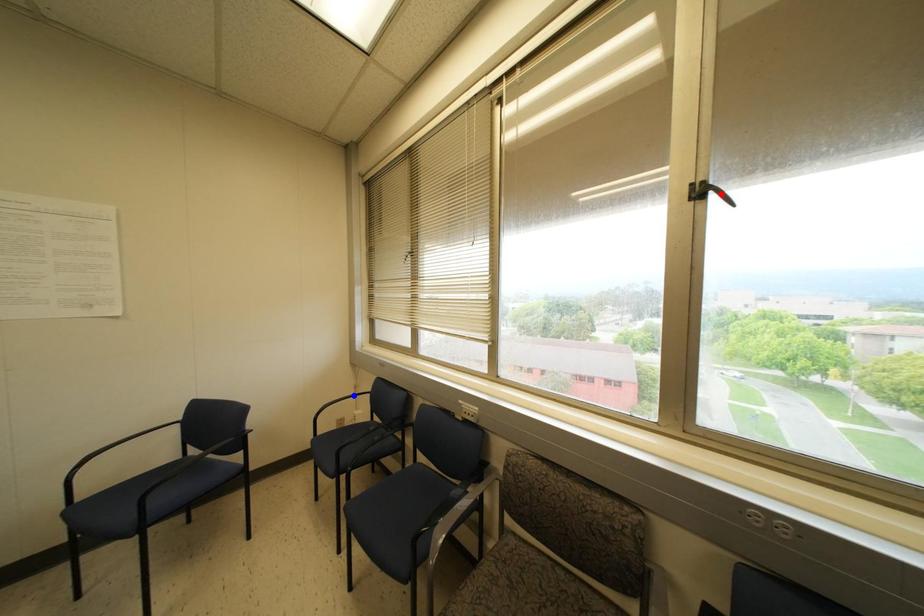
Question: Which of the two points in the image is closer to the camera?

Choices:
 (A) Blue point is closer.
 (B) Red point is closer.

Answer: (B)